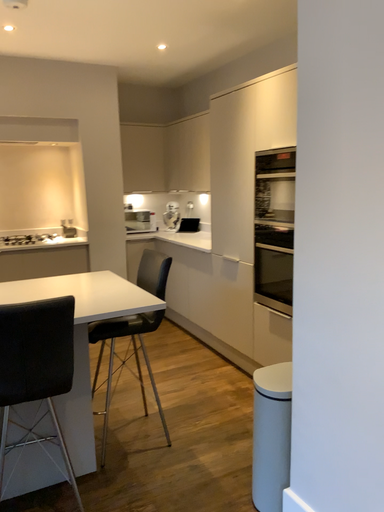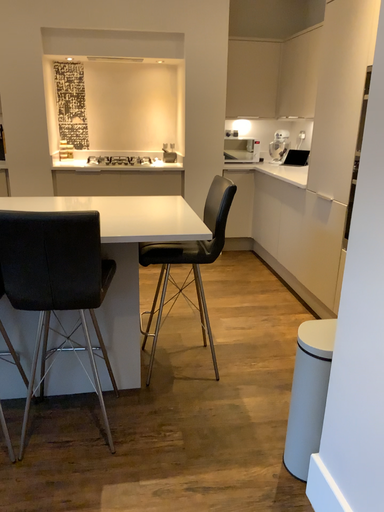
Question: How did the camera likely rotate when shooting the video?

Choices:
 (A) rotated right
 (B) rotated left

Answer: (B)